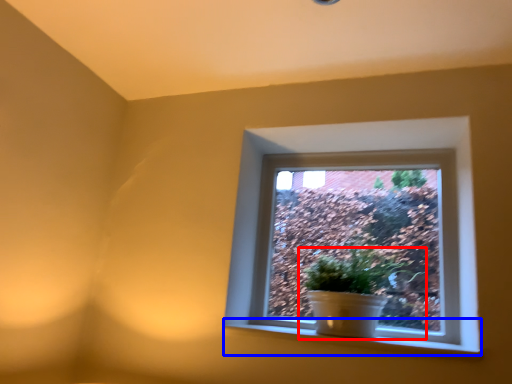
Question: Among these objects, which one is farthest to the camera, houseplant (highlighted by a red box) or window sill (highlighted by a blue box)?

Choices:
 (A) houseplant
 (B) window sill

Answer: (A)